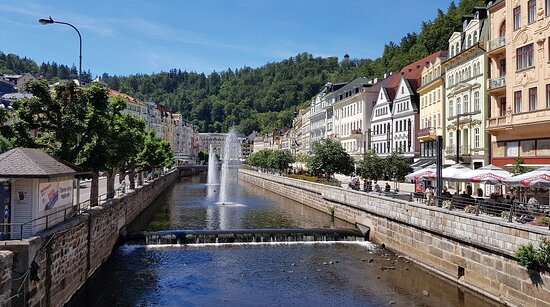
Where is `light`? This screenshot has height=307, width=550. light is located at coordinates (42, 19).